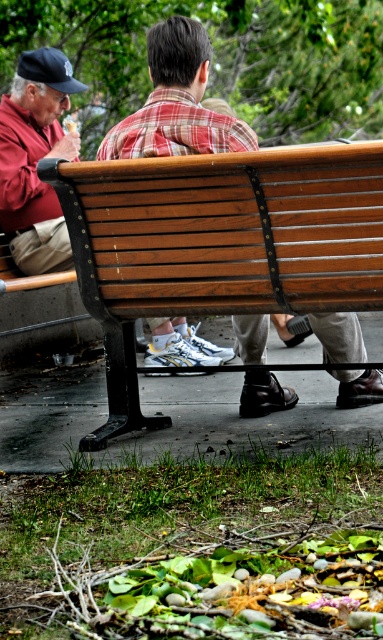
Is wooden bench at center taller than matte red shirt at left?

No.

Who is positioned more to the right, wooden bench at center or matte red shirt at left?

From the viewer's perspective, wooden bench at center appears more on the right side.

The width and height of the screenshot is (383, 640). What do you see at coordinates (176, 100) in the screenshot?
I see `wooden bench at center` at bounding box center [176, 100].

Where is `wooden bench at center`? The width and height of the screenshot is (383, 640). wooden bench at center is located at coordinates (176, 100).